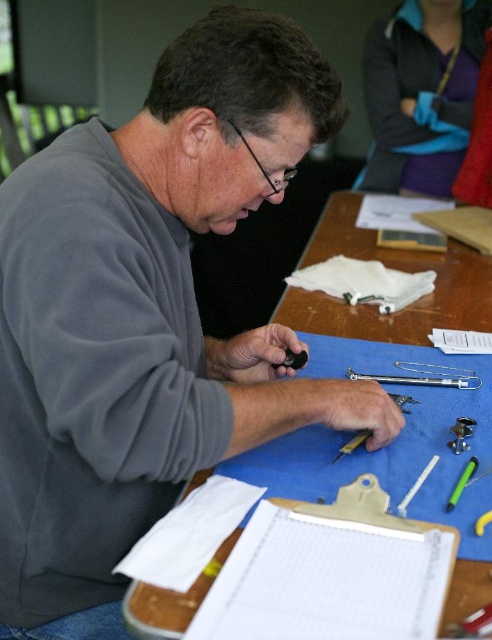
Who is higher up, white cloth at center or chrome metallic syringe at center?

white cloth at center

Is white cloth at center bigger than chrome metallic syringe at center?

Yes.

Is point (389, 307) positioned behind point (355, 374)?

Yes, it is behind point (355, 374).

I want to click on white cloth at center, so click(364, 282).

Is chrome metallic syringe at center closer to the viewer compared to metallic silver screwdriver at center?

No, chrome metallic syringe at center is behind metallic silver screwdriver at center.

What do you see at coordinates (424, 376) in the screenshot?
I see `chrome metallic syringe at center` at bounding box center [424, 376].

Locate an element on the screen. Image resolution: width=492 pixels, height=640 pixels. chrome metallic syringe at center is located at coordinates (424, 376).

Can you confirm if white paper at lower center is positioned above white cloth at center?

No, white paper at lower center is not above white cloth at center.

Who is shorter, white paper at lower center or white cloth at center?

With less height is white paper at lower center.

Locate an element on the screen. white paper at lower center is located at coordinates (331, 572).

The height and width of the screenshot is (640, 492). I want to click on white paper at lower center, so click(331, 572).